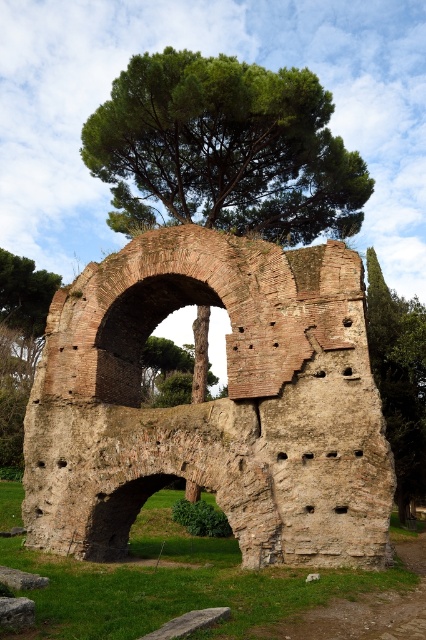
Question: Is brick stone arch at center positioned in front of green leafy tree at upper center?

Choices:
 (A) yes
 (B) no

Answer: (A)

Question: In this image, where is brick stone arch at center located relative to green leafy tree at upper center?

Choices:
 (A) below
 (B) above

Answer: (A)

Question: Which of the following is the closest to the observer?

Choices:
 (A) brick stone arch at center
 (B) green leafy tree at upper center

Answer: (A)

Question: Is brick stone arch at center positioned in front of green leafy tree at upper center?

Choices:
 (A) no
 (B) yes

Answer: (B)